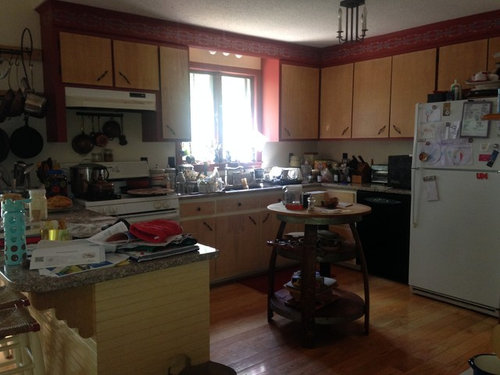
This screenshot has width=500, height=375. Identify the location of drawer. (205, 210).